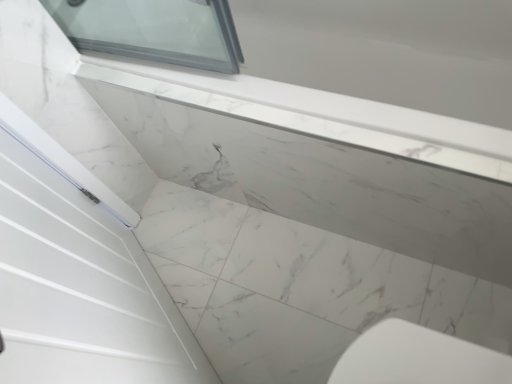
Question: Should I look upward or downward to see white marble window sill at upper center?

Choices:
 (A) up
 (B) down

Answer: (A)

Question: Can you confirm if white marble countertop at upper center is shorter than white marble window sill at upper center?

Choices:
 (A) yes
 (B) no

Answer: (A)

Question: From the image's perspective, is white marble countertop at upper center above white marble window sill at upper center?

Choices:
 (A) yes
 (B) no

Answer: (B)

Question: Is white marble countertop at upper center not within white marble window sill at upper center?

Choices:
 (A) yes
 (B) no

Answer: (A)

Question: Is white marble countertop at upper center oriented towards white marble window sill at upper center?

Choices:
 (A) yes
 (B) no

Answer: (B)

Question: Can you confirm if white marble countertop at upper center is smaller than white marble window sill at upper center?

Choices:
 (A) no
 (B) yes

Answer: (B)

Question: Does white marble countertop at upper center lie in front of white marble window sill at upper center?

Choices:
 (A) yes
 (B) no

Answer: (B)

Question: Is white marble window sill at upper center to the left of white marble countertop at upper center from the viewer's perspective?

Choices:
 (A) yes
 (B) no

Answer: (B)

Question: Does white marble window sill at upper center have a greater width compared to white marble countertop at upper center?

Choices:
 (A) no
 (B) yes

Answer: (A)

Question: Is white marble window sill at upper center shorter than white marble countertop at upper center?

Choices:
 (A) no
 (B) yes

Answer: (A)

Question: From the image's perspective, is white marble window sill at upper center on top of white marble countertop at upper center?

Choices:
 (A) yes
 (B) no

Answer: (A)

Question: Is white marble window sill at upper center thinner than white marble countertop at upper center?

Choices:
 (A) no
 (B) yes

Answer: (B)

Question: Is the position of white marble window sill at upper center less distant than that of white marble countertop at upper center?

Choices:
 (A) yes
 (B) no

Answer: (A)

Question: From a real-world perspective, is white marble countertop at upper center positioned above or below white marble window sill at upper center?

Choices:
 (A) below
 (B) above

Answer: (A)